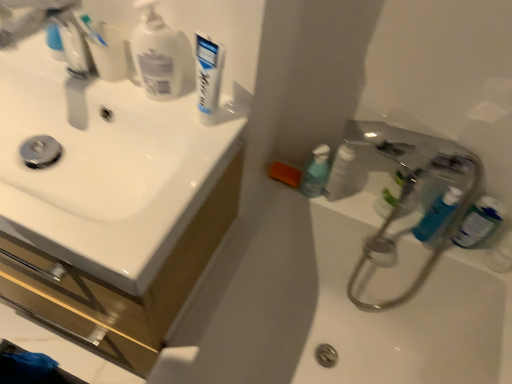
The width and height of the screenshot is (512, 384). I want to click on white glossy sink at upper left, so click(x=118, y=284).

What is the approximate width of blue plastic mouthwash at right, marked as the third mouthwash in a left-to-right arrangement?

5.50 centimeters.

What do you see at coordinates (479, 222) in the screenshot?
I see `blue plastic mouthwash at right, which is the 1th mouthwash from right to left` at bounding box center [479, 222].

Measure the distance between point (325, 154) and camera.

Answer: A distance of 3.35 feet exists between point (325, 154) and camera.

The image size is (512, 384). Describe the element at coordinates (331, 308) in the screenshot. I see `white glossy bath at lower right` at that location.

Locate an element on the screen. white glossy bath at lower right is located at coordinates (331, 308).

Locate an element on the screen. The width and height of the screenshot is (512, 384). blue translucent bottle at right, which is the 2th toiletry from left to right is located at coordinates (437, 214).

This screenshot has width=512, height=384. I want to click on white glossy toothpaste tube at right, positioned as the third toiletry in right-to-left order, so click(340, 172).

How much space does white glossy toothpaste tube at right, positioned as the third toiletry in right-to-left order, occupy horizontally?

It is 2.48 inches.

At what (x,y) coordinates should I click in order to perform the action: click on blue glossy bottle at right, the 1th toiletry positioned from the right. Please return your answer as a coordinate pair (x, y). This screenshot has height=384, width=512. Looking at the image, I should click on (501, 255).

Measure the distance between point [500,247] and camera.

The depth of point [500,247] is 3.36 feet.

The width and height of the screenshot is (512, 384). I want to click on white glossy sink at upper left, so click(118, 284).

In terms of width, does white glossy sink at upper left look wider or thinner when compared to green translucent bottle at upper right, the second mouthwash positioned from the left?

white glossy sink at upper left is wider than green translucent bottle at upper right, the second mouthwash positioned from the left.

Based on the photo, is white glossy sink at upper left positioned far away from green translucent bottle at upper right, the second mouthwash positioned from the left?

Actually, white glossy sink at upper left and green translucent bottle at upper right, the second mouthwash positioned from the left, are a little close together.

From the image's perspective, which is above, white glossy sink at upper left or green translucent bottle at upper right, the second mouthwash positioned from the left?

green translucent bottle at upper right, the second mouthwash positioned from the left, from the image's perspective.

Is white glossy sink at upper left bigger than green translucent bottle at upper right, placed as the 2th mouthwash when sorted from right to left?

Yes.

Does white glossy toothpaste tube at right, which is counted as the first toiletry, starting from the left, appear on the left side of green translucent bottle at upper right, placed as the 2th mouthwash when sorted from right to left?

Yes, white glossy toothpaste tube at right, which is counted as the first toiletry, starting from the left, is to the left of green translucent bottle at upper right, placed as the 2th mouthwash when sorted from right to left.

Is white glossy toothpaste tube at right, positioned as the third toiletry in right-to-left order, shorter than green translucent bottle at upper right, placed as the 2th mouthwash when sorted from right to left?

No.

From a real-world perspective, does white glossy toothpaste tube at right, positioned as the third toiletry in right-to-left order, stand above green translucent bottle at upper right, placed as the 2th mouthwash when sorted from right to left?

Correct, in the physical world, white glossy toothpaste tube at right, positioned as the third toiletry in right-to-left order, is higher than green translucent bottle at upper right, placed as the 2th mouthwash when sorted from right to left.

Is white glossy toothpaste tube at right, which is counted as the first toiletry, starting from the left, not close to green translucent bottle at upper right, the second mouthwash positioned from the left?

white glossy toothpaste tube at right, which is counted as the first toiletry, starting from the left, is actually quite close to green translucent bottle at upper right, the second mouthwash positioned from the left.

Is white matte pump bottle at upper left touching blue glossy bottle at right, the 3th toiletry positioned from the left?

No, white matte pump bottle at upper left is not in contact with blue glossy bottle at right, the 3th toiletry positioned from the left.

In the scene shown: Does white matte pump bottle at upper left have a greater height compared to blue glossy bottle at right, the 1th toiletry positioned from the right?

Indeed, white matte pump bottle at upper left has a greater height compared to blue glossy bottle at right, the 1th toiletry positioned from the right.

Considering their positions, is white matte pump bottle at upper left located in front of or behind blue glossy bottle at right, the 3th toiletry positioned from the left?

white matte pump bottle at upper left is in front of blue glossy bottle at right, the 3th toiletry positioned from the left.

Does white glossy toothpaste tube at right, positioned as the third toiletry in right-to-left order, turn towards white matte pump bottle at upper left?

No, white glossy toothpaste tube at right, positioned as the third toiletry in right-to-left order, is not oriented towards white matte pump bottle at upper left.

Can you tell me how much white glossy toothpaste tube at right, which is counted as the first toiletry, starting from the left, and white matte pump bottle at upper left differ in facing direction?

The facing directions of white glossy toothpaste tube at right, which is counted as the first toiletry, starting from the left, and white matte pump bottle at upper left are 0.456 degrees apart.

From the image's perspective, does white glossy toothpaste tube at right, which is counted as the first toiletry, starting from the left, appear lower than white matte pump bottle at upper left?

Yes, from the image's perspective, white glossy toothpaste tube at right, which is counted as the first toiletry, starting from the left, is below white matte pump bottle at upper left.

Is green translucent bottle at upper right, the second mouthwash positioned from the left, completely or partially inside white glossy bath at lower right?

No, white glossy bath at lower right does not contain green translucent bottle at upper right, the second mouthwash positioned from the left.

Who is more distant, white glossy bath at lower right or green translucent bottle at upper right, the second mouthwash positioned from the left?

green translucent bottle at upper right, the second mouthwash positioned from the left.

The height and width of the screenshot is (384, 512). Identify the location of mouthwash that is the 1st object above the white glossy bath at lower right (from a real-world perspective). (390, 195).

From the image's perspective, which is above, white glossy bath at lower right or green translucent bottle at upper right, placed as the 2th mouthwash when sorted from right to left?

green translucent bottle at upper right, placed as the 2th mouthwash when sorted from right to left, is shown above in the image.

From the image's perspective, is white matte pump bottle at upper left above white glossy sink at upper left?

Correct, white matte pump bottle at upper left appears higher than white glossy sink at upper left in the image.

Based on the photo, which is in front, white matte pump bottle at upper left or white glossy sink at upper left?

white matte pump bottle at upper left is more forward.

How much distance is there between white matte pump bottle at upper left and white glossy sink at upper left?

A distance of 14.22 inches exists between white matte pump bottle at upper left and white glossy sink at upper left.

Is white matte pump bottle at upper left positioned with its back to white glossy sink at upper left?

No, white glossy sink at upper left is not at the back of white matte pump bottle at upper left.

Does point (160, 265) lie behind point (481, 221)?

No, (160, 265) is closer to viewer.

From the image's perspective, which one is positioned higher, white glossy sink at upper left or blue plastic mouthwash at right, marked as the third mouthwash in a left-to-right arrangement?

white glossy sink at upper left.

Which object is positioned more to the left, white glossy sink at upper left or blue plastic mouthwash at right, marked as the third mouthwash in a left-to-right arrangement?

Positioned to the left is white glossy sink at upper left.

From the white glossy sink at upper left, count 2nd mouthwash to the right and point to it. Please provide its 2D coordinates.

[(390, 195)]

From the image's perspective, starting from the white glossy toothpaste tube at right, positioned as the third toiletry in right-to-left order, which mouthwash is the 1st one below? Please provide its 2D coordinates.

[(390, 195)]

Based on their spatial positions, is white glossy sink at upper left or blue plastic mouthwash at right, marked as the third mouthwash in a left-to-right arrangement, closer to blue glossy bottle at right, the 3th toiletry positioned from the left?

Based on the image, blue plastic mouthwash at right, marked as the third mouthwash in a left-to-right arrangement, appears to be nearer to blue glossy bottle at right, the 3th toiletry positioned from the left.

Which object lies further to the anchor point white glossy toothpaste tube at right, positioned as the third toiletry in right-to-left order, blue glossy bottle at right, the 3th toiletry positioned from the left, or blue glossy mouthwash at lower right, the third mouthwash when ordered from right to left?

Among the two, blue glossy bottle at right, the 3th toiletry positioned from the left, is located further to white glossy toothpaste tube at right, positioned as the third toiletry in right-to-left order.

Looking at the image, which one is located closer to blue translucent bottle at right, which is the 2th toiletry from left to right, white glossy toothpaste at upper center or white matte pump bottle at upper left?

white glossy toothpaste at upper center is positioned closer to the anchor blue translucent bottle at right, which is the 2th toiletry from left to right.

From the image, which object appears to be nearer to white glossy sink at upper left, blue glossy mouthwash at lower right, the third mouthwash when ordered from right to left, or white matte pump bottle at upper left?

Among the two, white matte pump bottle at upper left is located nearer to white glossy sink at upper left.

Based on their spatial positions, is green translucent bottle at upper right, the second mouthwash positioned from the left, or blue glossy bottle at right, the 1th toiletry positioned from the right, closer to white glossy sink at upper left?

The object closer to white glossy sink at upper left is green translucent bottle at upper right, the second mouthwash positioned from the left.

From the image, which object appears to be nearer to white glossy sink at upper left, blue plastic mouthwash at right, marked as the third mouthwash in a left-to-right arrangement, or white matte pump bottle at upper left?

Based on the image, white matte pump bottle at upper left appears to be nearer to white glossy sink at upper left.

When comparing their distances from white glossy sink at upper left, does blue glossy bottle at right, the 1th toiletry positioned from the right, or green translucent bottle at upper right, the second mouthwash positioned from the left, seem further?

blue glossy bottle at right, the 1th toiletry positioned from the right, lies further to white glossy sink at upper left than the other object.

Which object lies further to the anchor point white glossy sink at upper left, blue glossy bottle at right, the 3th toiletry positioned from the left, or blue plastic mouthwash at right, which is the 1th mouthwash from right to left?

blue glossy bottle at right, the 3th toiletry positioned from the left, lies further to white glossy sink at upper left than the other object.

You are a GUI agent. You are given a task and a screenshot of the screen. Output one action in this format:
    pyautogui.click(x=<x>, y=<y>)
    Task: Click on the toiletry situated between white glossy sink at upper left and white glossy bath at lower right from left to right
    The image size is (512, 384).
    Given the screenshot: What is the action you would take?
    pyautogui.click(x=340, y=172)

At what (x,y) coordinates should I click in order to perform the action: click on toiletry situated between green translucent bottle at upper right, the second mouthwash positioned from the left, and blue glossy bottle at right, the 3th toiletry positioned from the left, from left to right. Please return your answer as a coordinate pair (x, y). Looking at the image, I should click on (437, 214).

Locate an element on the screen. Image resolution: width=512 pixels, height=384 pixels. mouthwash that lies between blue translucent bottle at right, which is the 2th toiletry from left to right, and white glossy bath at lower right from top to bottom is located at coordinates (479, 222).

Locate an element on the screen. The height and width of the screenshot is (384, 512). cleaning product between white glossy toothpaste at upper center and white glossy toothpaste tube at right, positioned as the third toiletry in right-to-left order, in the front-back direction is located at coordinates (156, 54).